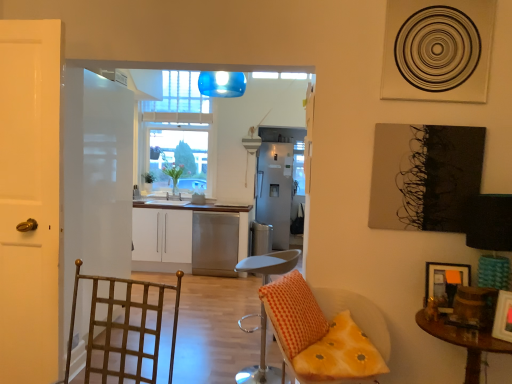
Question: From the image's perspective, is wooden picture frame at lower right, which ranks as the second picture frame in front-to-back order, located above or below clear glass window at center?

Choices:
 (A) above
 (B) below

Answer: (B)

Question: Considering the positions of point (437, 294) and point (201, 173), is point (437, 294) closer or farther from the camera than point (201, 173)?

Choices:
 (A) closer
 (B) farther

Answer: (A)

Question: Which of these objects is positioned farthest from the white glossy cabinets at center?

Choices:
 (A) white glossy door at left, which is the second door in right-to-left order
 (B) yellow fabric cushion at lower right
 (C) wooden picture frame at lower right, positioned as the first picture frame in front-to-back order
 (D) metallic gold swivel chair at left
 (E) orange checkered pillow at center

Answer: (C)

Question: Which is nearer to the satin silver refrigerator at center?

Choices:
 (A) orange checkered pillow at center
 (B) metallic gold swivel chair at left
 (C) white glossy door at left, which is the second door in right-to-left order
 (D) wooden picture frame at lower right, positioned as the first picture frame in front-to-back order
 (E) clear glass window at center

Answer: (E)